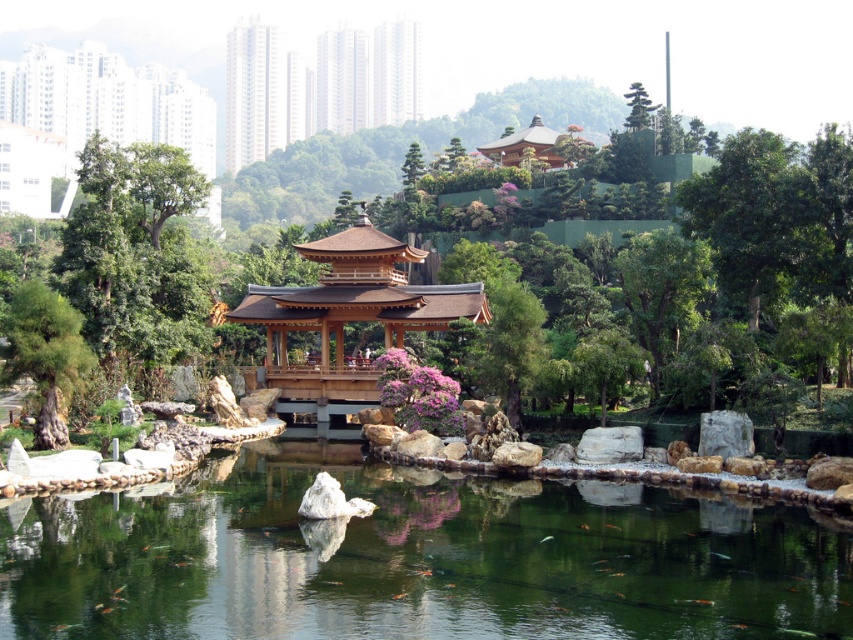
Question: Which object is positioned closest to the natural wood gazebo at center?

Choices:
 (A) green textured tree at left
 (B) green leafy tree at upper right
 (C) clear water at pond center

Answer: (A)

Question: Estimate the real-world distances between objects in this image. Which object is farther from the green textured tree at left?

Choices:
 (A) green leafy tree at upper right
 (B) natural wood gazebo at center
 (C) wooden pagoda at upper center

Answer: (C)

Question: Does green leafy tree at upper right have a greater width compared to green textured tree at left?

Choices:
 (A) yes
 (B) no

Answer: (A)

Question: In this image, where is clear water at pond center located relative to wooden pagoda at upper center?

Choices:
 (A) right
 (B) left

Answer: (A)

Question: Which point is farther to the camera?

Choices:
 (A) green leafy tree at upper right
 (B) clear water at pond center
 (C) green textured tree at left
 (D) wooden pagoda at upper center

Answer: (D)

Question: Is clear water at pond center to the left of wooden pagoda at upper center from the viewer's perspective?

Choices:
 (A) no
 (B) yes

Answer: (A)